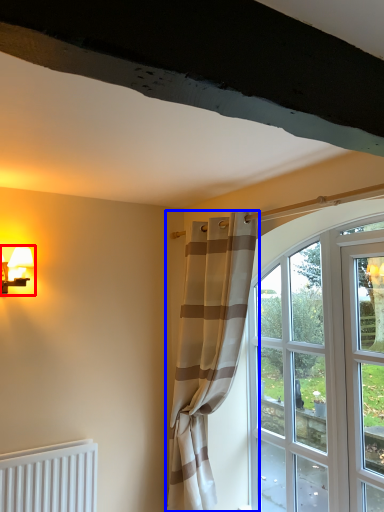
Question: Which object appears closest to the camera in this image, table lamp (highlighted by a red box) or curtain (highlighted by a blue box)?

Choices:
 (A) table lamp
 (B) curtain

Answer: (B)